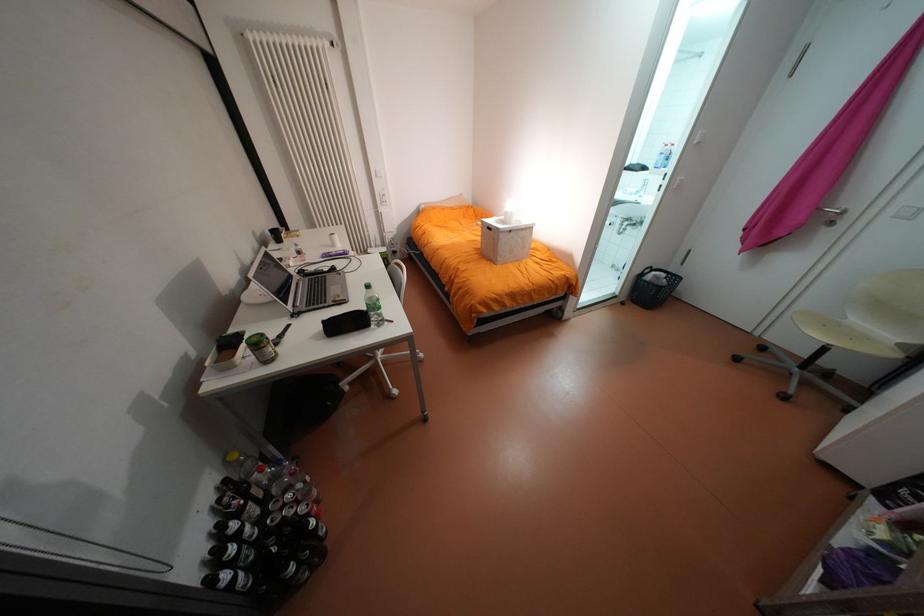
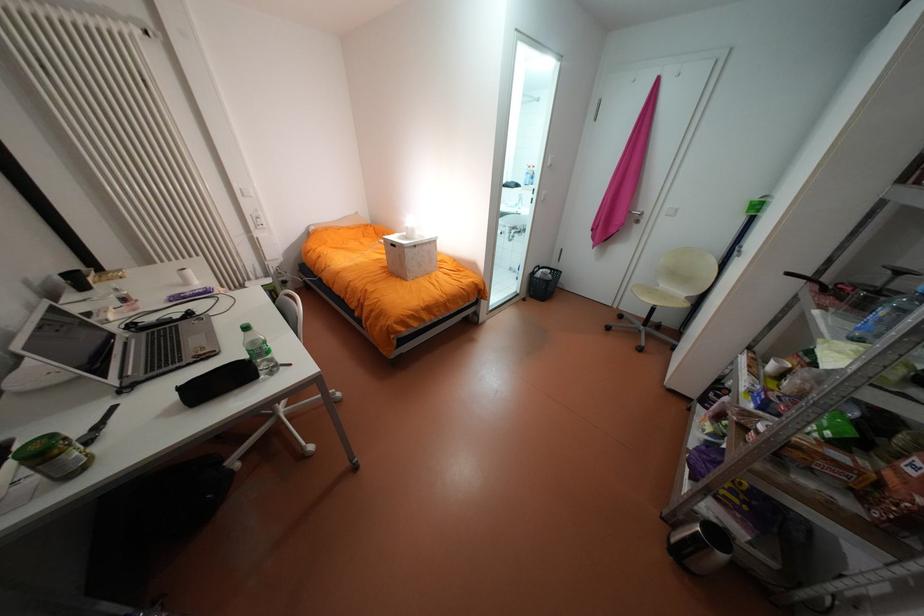
Question: The camera is either moving clockwise (left) or counter-clockwise (right) around the object. The first image is from the beginning of the video and the second image is from the end. Is the camera moving left or right when shooting the video?

Choices:
 (A) Left
 (B) Right

Answer: (A)